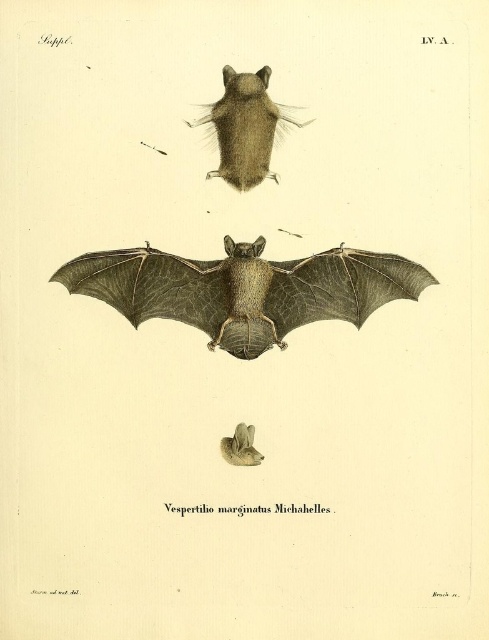
You are observing the bat in flight in the middle section of the illustration. There are two points marked on the bat, one at coordinates point (274, 314) and another at point (236, 461). Which of these two points is closer to you?

Point (274, 314) is further to the viewer than point (236, 461), so point (274, 314) is closer to you.

From the picture: You are examining the scientific illustration of the bat species Vespertilio marginatus Michahelles. The image has three sections. In the middle section, there are two points marked at coordinates point (267,166) and point (244,444). From your perspective as an observer looking at the illustration, which of these two points appears closer to you?

Point (267,166) is further to the viewer than point (244,444), so the point at (267,166) appears closer to you.

You are examining the scientific illustration of the bat species Vespertilio marginatus Michahelles. You notice two bats in the middle section of the image. Which one is closer to you, the brown leather bat at center or the furry brown bat at upper center?

The brown leather bat at center is closer to the viewer than the furry brown bat at upper center.